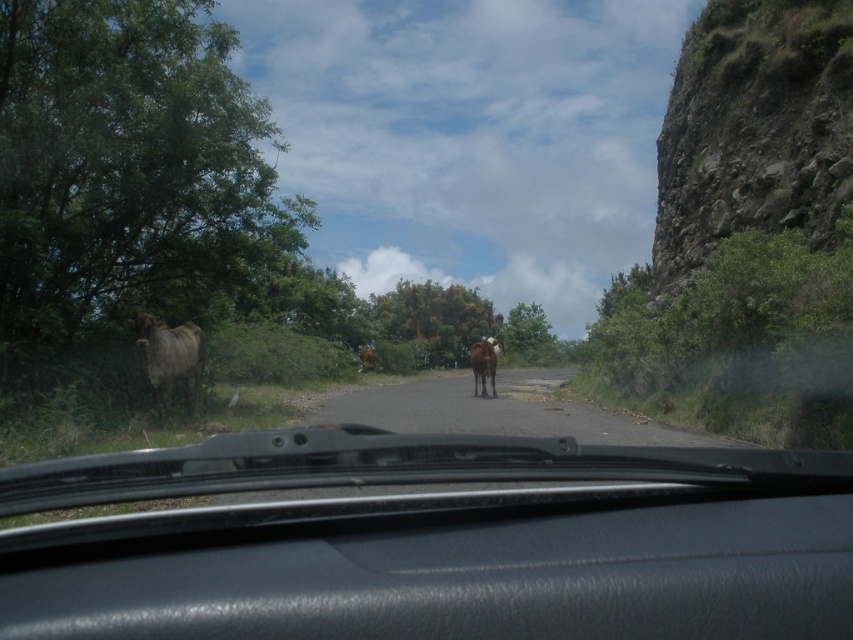
Is brown dirt road at center above brown glossy cow at center?

Actually, brown dirt road at center is below brown glossy cow at center.

Does brown dirt road at center have a lesser width compared to brown glossy cow at center?

In fact, brown dirt road at center might be wider than brown glossy cow at center.

Locate an element on the screen. The width and height of the screenshot is (853, 640). brown dirt road at center is located at coordinates (497, 410).

This screenshot has width=853, height=640. In order to click on brown dirt road at center in this screenshot , I will do `click(497, 410)`.

Is point (521, 394) behind point (190, 339)?

Yes, point (521, 394) is farther from viewer.

Does point (556, 385) lie behind point (163, 374)?

Yes.

At what (x,y) coordinates should I click in order to perform the action: click on brown dirt road at center. Please return your answer as a coordinate pair (x, y). The image size is (853, 640). Looking at the image, I should click on (497, 410).

Does black matte windshield wipers at center have a lesser height compared to brown dirt road at center?

Correct, black matte windshield wipers at center is not as tall as brown dirt road at center.

What are the coordinates of `black matte windshield wipers at center` in the screenshot? It's located at (434, 541).

Which is in front, point (599, 502) or point (440, 378)?

Point (599, 502) is in front.

Find the location of `black matte windshield wipers at center`. black matte windshield wipers at center is located at coordinates (434, 541).